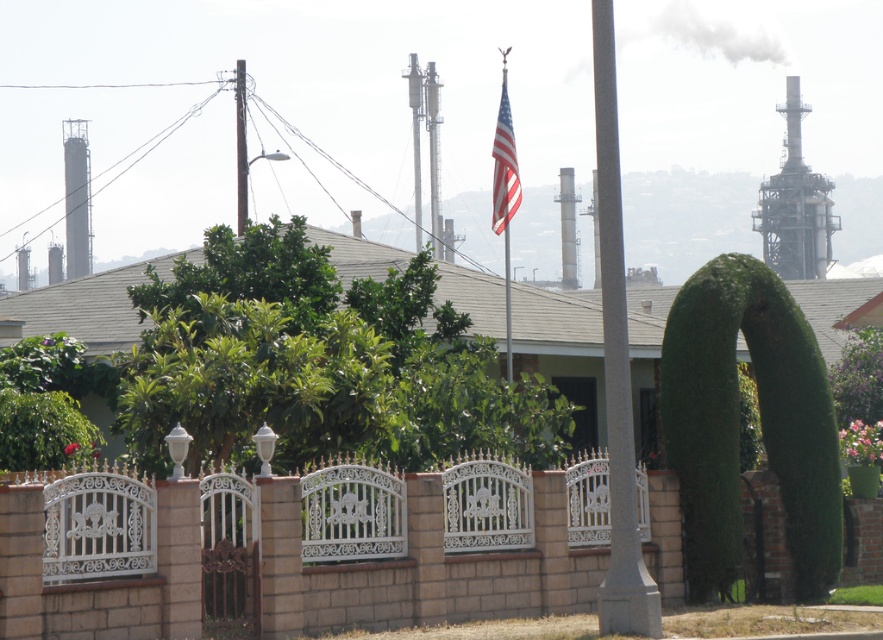
Between point (100, 442) and point (243, 182), which one is positioned in front?

Positioned in front is point (100, 442).

Is green leafy hedge at center positioned at the back of metallic pole at upper center?

No.

This screenshot has width=883, height=640. What do you see at coordinates (43, 429) in the screenshot? I see `green leafy hedge at center` at bounding box center [43, 429].

At what (x,y) coordinates should I click in order to perform the action: click on green leafy hedge at center. Please return your answer as a coordinate pair (x, y). Looking at the image, I should click on (43, 429).

Does gray concrete pole at center appear under metallic silver flag pole at center?

Indeed, gray concrete pole at center is positioned under metallic silver flag pole at center.

Is point (621, 333) positioned before point (508, 132)?

Yes, it is.

Which is in front, point (617, 228) or point (493, 195)?

Point (617, 228) is more forward.

This screenshot has width=883, height=640. Find the location of `gray concrete pole at center`. gray concrete pole at center is located at coordinates (616, 364).

Which is more to the right, american flag at center or metallic pole at upper center?

american flag at center

In the scene shown: Is american flag at center shorter than metallic pole at upper center?

No, american flag at center is not shorter than metallic pole at upper center.

Does point (502, 122) come behind point (238, 120)?

No.

The width and height of the screenshot is (883, 640). In order to click on american flag at center in this screenshot , I will do (x=504, y=166).